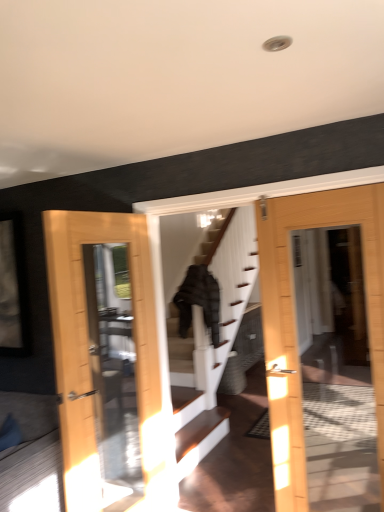
This screenshot has height=512, width=384. In order to click on dark gray fabric coat at center in this screenshot , I will do `click(199, 300)`.

What do you see at coordinates (199, 300) in the screenshot?
I see `dark gray fabric coat at center` at bounding box center [199, 300].

Where is `dark gray fabric coat at center`? dark gray fabric coat at center is located at coordinates (199, 300).